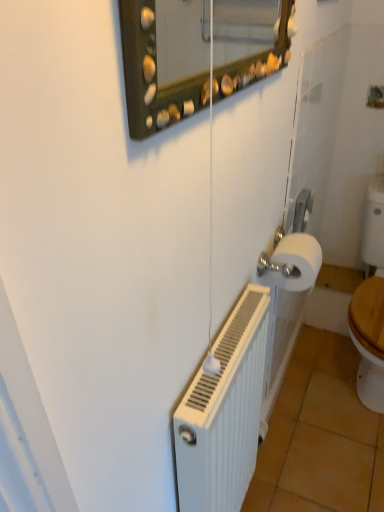
Question: Is orange tile at lower right closer to camera compared to white ribbed radiator at lower right?

Choices:
 (A) no
 (B) yes

Answer: (A)

Question: Does orange tile at lower right turn towards white ribbed radiator at lower right?

Choices:
 (A) yes
 (B) no

Answer: (B)

Question: From the image's perspective, is orange tile at lower right above white ribbed radiator at lower right?

Choices:
 (A) yes
 (B) no

Answer: (B)

Question: Is orange tile at lower right thinner than white ribbed radiator at lower right?

Choices:
 (A) no
 (B) yes

Answer: (A)

Question: From a real-world perspective, is orange tile at lower right beneath white ribbed radiator at lower right?

Choices:
 (A) yes
 (B) no

Answer: (A)

Question: Is white matte toilet paper at right bigger or smaller than white ribbed radiator at lower right?

Choices:
 (A) small
 (B) big

Answer: (A)

Question: In terms of width, does white matte toilet paper at right look wider or thinner when compared to white ribbed radiator at lower right?

Choices:
 (A) wide
 (B) thin

Answer: (A)

Question: Choose the correct answer: Is white matte toilet paper at right inside white ribbed radiator at lower right or outside it?

Choices:
 (A) inside
 (B) outside

Answer: (B)

Question: Is white matte toilet paper at right to the left or to the right of white ribbed radiator at lower right in the image?

Choices:
 (A) right
 (B) left

Answer: (A)

Question: Is orange tile at lower right wider or thinner than white ribbed radiator at lower right?

Choices:
 (A) wide
 (B) thin

Answer: (A)

Question: Considering their positions, is orange tile at lower right located in front of or behind white ribbed radiator at lower right?

Choices:
 (A) behind
 (B) front

Answer: (A)

Question: Based on their positions, is orange tile at lower right located to the left or right of white ribbed radiator at lower right?

Choices:
 (A) right
 (B) left

Answer: (A)

Question: From the image's perspective, is orange tile at lower right located above or below white ribbed radiator at lower right?

Choices:
 (A) below
 (B) above

Answer: (A)

Question: From a real-world perspective, relative to orange tile at lower right, is white ribbed radiator at lower right vertically above or below?

Choices:
 (A) above
 (B) below

Answer: (A)

Question: Considering their positions, is white ribbed radiator at lower right located in front of or behind orange tile at lower right?

Choices:
 (A) front
 (B) behind

Answer: (A)